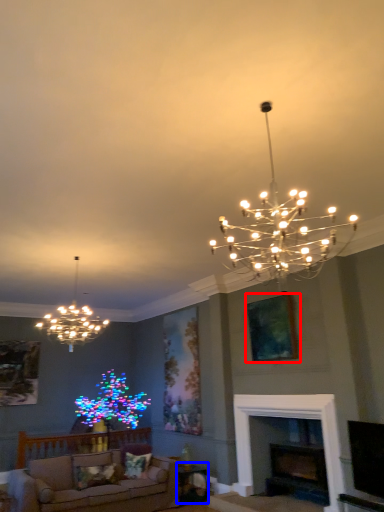
Question: Which of the following is the farthest to the observer, picture frame (highlighted by a red box) or table (highlighted by a blue box)?

Choices:
 (A) picture frame
 (B) table

Answer: (B)